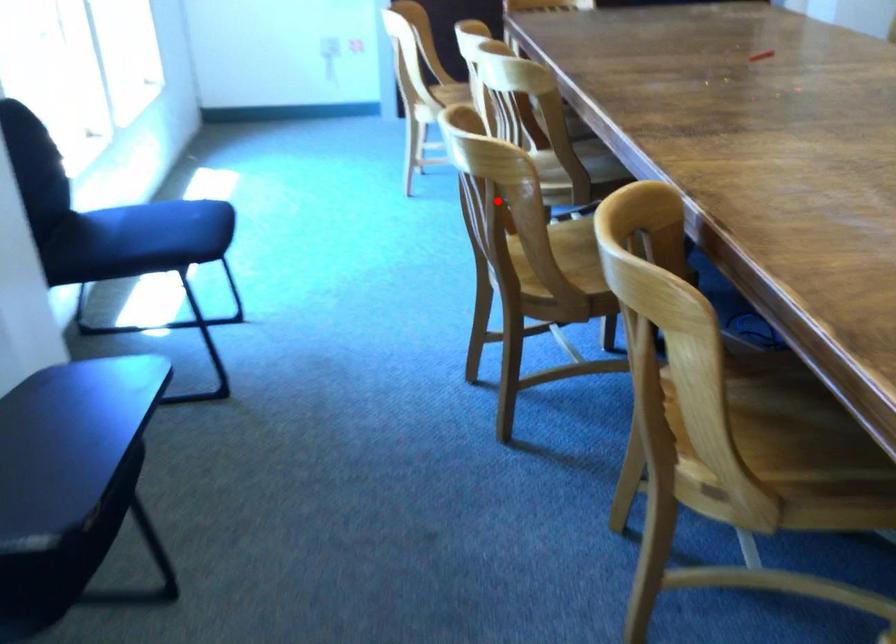
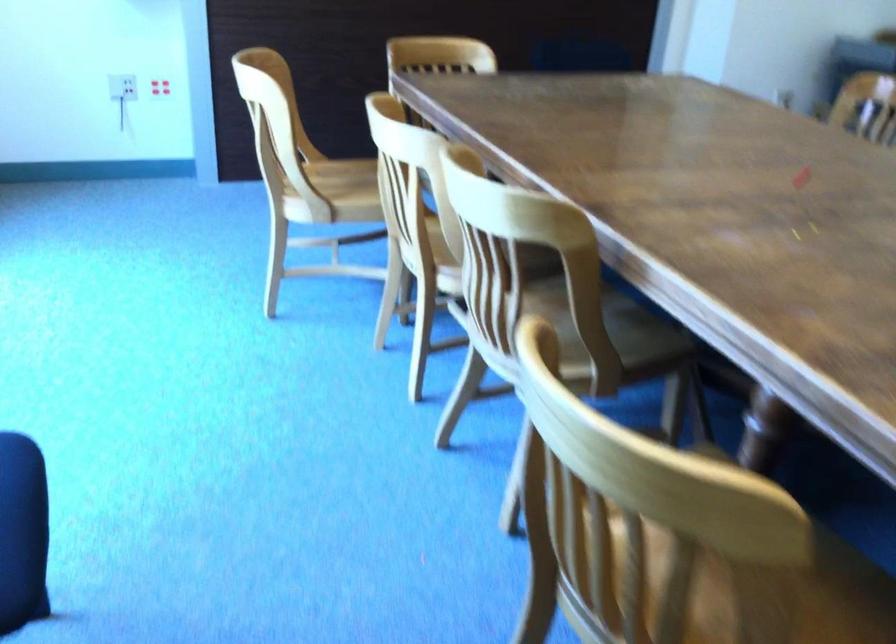
Find the pixel in the second image that matches the highlighted location in the first image.

(685, 570)